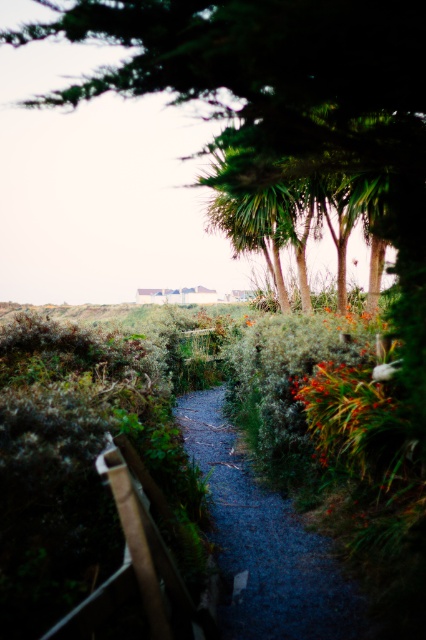
Looking at this image, you are a gardener planning to plant a new tree along the dark gray gravel path at center. Considering the green leafy tree at upper center is already there, where should you place the new tree to avoid shading the path?

The green leafy tree at upper center is positioned over the dark gray gravel path at center, so planting the new tree in a different area away from the path would prevent shading it.

You are a gardener who wants to place a new decorative stone on the dark gray gravel path at center so it stands out. Considering their heights, which object should you place the stone on to ensure it is visible above the green fuzzy plant at center?

The dark gray gravel path at center has a lesser height compared to green fuzzy plant at center. To ensure visibility above the green fuzzy plant at center, place the stone on the green fuzzy plant at center since it is taller.

You are standing at the starting point of the pathway and see two points marked on the path. The first point is at coordinates point [342,109] and the second is at point [221,416]. If you were to walk along the path from where you are, which point would you encounter first?

Point [342,109] is in front of point [221,416], so you would encounter point [342,109] first while walking along the path.